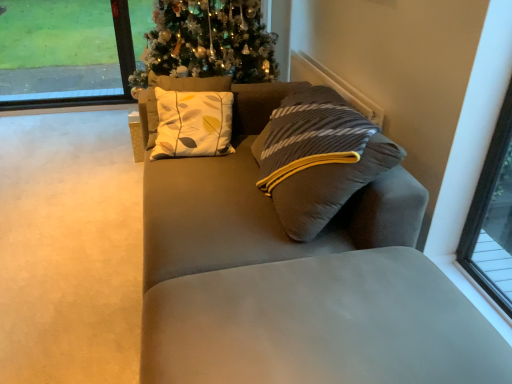
The height and width of the screenshot is (384, 512). What do you see at coordinates (297, 280) in the screenshot? I see `suede gray couch at center` at bounding box center [297, 280].

In order to face transparent glass window at upper left, should I rotate leftwards or rightwards?

Turn left by 25.017 degrees to look at transparent glass window at upper left.

Where is `beige carpet at lower left`? The image size is (512, 384). beige carpet at lower left is located at coordinates (69, 249).

Is there a large distance between beige carpet at lower left and transparent glass window at upper left?

Yes, beige carpet at lower left and transparent glass window at upper left are located far from each other.

Could you tell me if beige carpet at lower left is turned towards transparent glass window at upper left?

No, beige carpet at lower left is not turned towards transparent glass window at upper left.

Considering the sizes of beige carpet at lower left and transparent glass window at upper left in the image, is beige carpet at lower left bigger or smaller than transparent glass window at upper left?

In the image, beige carpet at lower left appears to be larger than transparent glass window at upper left.

From a real-world perspective, is beige carpet at lower left under transparent glass window at upper left?

Yes.

Considering the relative sizes of transparent glass window at upper left and suede gray couch at center in the image provided, is transparent glass window at upper left shorter than suede gray couch at center?

In fact, transparent glass window at upper left may be taller than suede gray couch at center.

Considering the sizes of objects transparent glass window at upper left and suede gray couch at center in the image provided, who is smaller, transparent glass window at upper left or suede gray couch at center?

Smaller between the two is transparent glass window at upper left.

From the image's perspective, is transparent glass window at upper left beneath suede gray couch at center?

Actually, transparent glass window at upper left appears above suede gray couch at center in the image.

Consider the image. From the image's perspective, is suede gray couch at center beneath beige carpet at lower left?

Actually, suede gray couch at center appears above beige carpet at lower left in the image.

Consider the image. Would you say suede gray couch at center is inside or outside beige carpet at lower left?

suede gray couch at center is not inside beige carpet at lower left, it's outside.

Does point (373, 242) come closer to viewer compared to point (14, 242)?

Yes, point (373, 242) is in front of point (14, 242).

Considering the relative sizes of beige carpet at lower left and suede gray couch at center in the image provided, is beige carpet at lower left bigger than suede gray couch at center?

Actually, beige carpet at lower left might be smaller than suede gray couch at center.

Does point (94, 296) come behind point (211, 187)?

That is False.

From the image's perspective, which one is positioned higher, beige carpet at lower left or suede gray couch at center?

From the image's view, suede gray couch at center is above.

How much distance is there between transparent glass window at upper left and beige carpet at lower left?

Result: They are 1.58 meters apart.

This screenshot has width=512, height=384. What are the coordinates of `window located above the beige carpet at lower left (from the image's perspective)` in the screenshot? It's located at (64, 54).

Considering their positions, is transparent glass window at upper left located in front of or behind beige carpet at lower left?

transparent glass window at upper left is behind beige carpet at lower left.

Based on the photo, is suede gray couch at center not inside transparent glass window at upper left?

That's correct, suede gray couch at center is outside of transparent glass window at upper left.

In the image, is suede gray couch at center positioned in front of or behind transparent glass window at upper left?

Visually, suede gray couch at center is located in front of transparent glass window at upper left.

Is suede gray couch at center facing towards transparent glass window at upper left?

No, suede gray couch at center is not aimed at transparent glass window at upper left.

Is there a large distance between suede gray couch at center and transparent glass window at upper left?

Yes.

Where is `window above the beige carpet at lower left (from the image's perspective)`? This screenshot has height=384, width=512. window above the beige carpet at lower left (from the image's perspective) is located at coordinates (64, 54).

You are a GUI agent. You are given a task and a screenshot of the screen. Output one action in this format:
    pyautogui.click(x=<x>, y=<y>)
    Task: Click on the studio couch below the transparent glass window at upper left (from a real-world perspective)
    
    Given the screenshot: What is the action you would take?
    pyautogui.click(x=297, y=280)

From the image, which object appears to be nearer to transparent glass window at upper left, beige carpet at lower left or suede gray couch at center?

beige carpet at lower left is positioned closer to the anchor transparent glass window at upper left.

Which object lies nearer to the anchor point transparent glass window at upper left, suede gray couch at center or beige carpet at lower left?

beige carpet at lower left is positioned closer to the anchor transparent glass window at upper left.

From the image, which object appears to be nearer to beige carpet at lower left, transparent glass window at upper left or suede gray couch at center?

suede gray couch at center is closer to beige carpet at lower left.

Based on their spatial positions, is beige carpet at lower left or transparent glass window at upper left closer to suede gray couch at center?

beige carpet at lower left lies closer to suede gray couch at center than the other object.

Considering their positions, is suede gray couch at center positioned closer to beige carpet at lower left than transparent glass window at upper left?

Based on the image, suede gray couch at center appears to be nearer to beige carpet at lower left.

From the image, which object appears to be nearer to suede gray couch at center, transparent glass window at upper left or beige carpet at lower left?

beige carpet at lower left is closer to suede gray couch at center.

You are a GUI agent. You are given a task and a screenshot of the screen. Output one action in this format:
    pyautogui.click(x=<x>, y=<y>)
    Task: Click on the studio couch positioned between beige carpet at lower left and transparent glass window at upper left from near to far
    Image resolution: width=512 pixels, height=384 pixels.
    Given the screenshot: What is the action you would take?
    pyautogui.click(x=297, y=280)